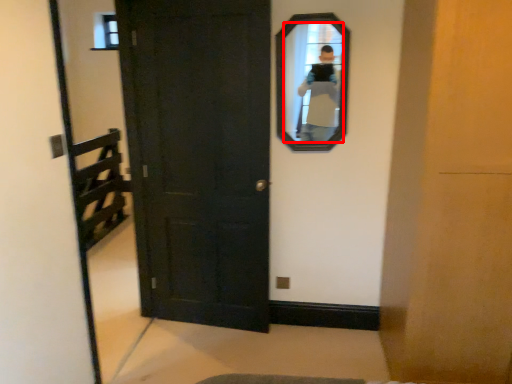
Question: From the image's perspective, where is mirror (annotated by the red box) located relative to door?

Choices:
 (A) below
 (B) above

Answer: (B)